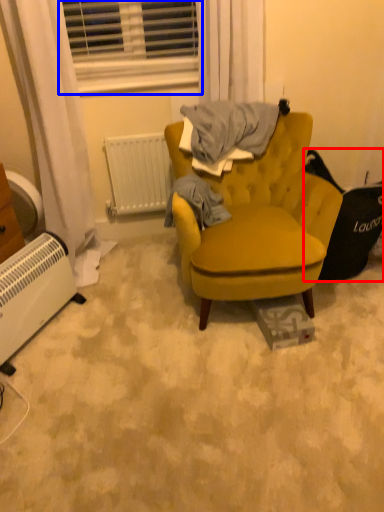
Question: Which object appears farthest to the camera in this image, swivel chair (highlighted by a red box) or window (highlighted by a blue box)?

Choices:
 (A) swivel chair
 (B) window

Answer: (B)